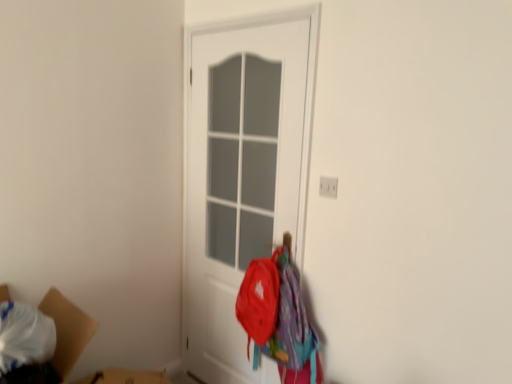
Question: In terms of size, does white plastic electric outlet at upper right appear bigger or smaller than cardboard box at lower left?

Choices:
 (A) small
 (B) big

Answer: (A)

Question: In terms of width, does white plastic electric outlet at upper right look wider or thinner when compared to cardboard box at lower left?

Choices:
 (A) thin
 (B) wide

Answer: (A)

Question: Considering the real-world distances, which object is farthest from the white matte door at center?

Choices:
 (A) white plastic electric outlet at upper right
 (B) matte red backpack at lower right
 (C) cardboard box at lower left

Answer: (C)

Question: Which is farther from the matte red backpack at lower right?

Choices:
 (A) cardboard box at lower left
 (B) white plastic electric outlet at upper right
 (C) white matte door at center

Answer: (A)